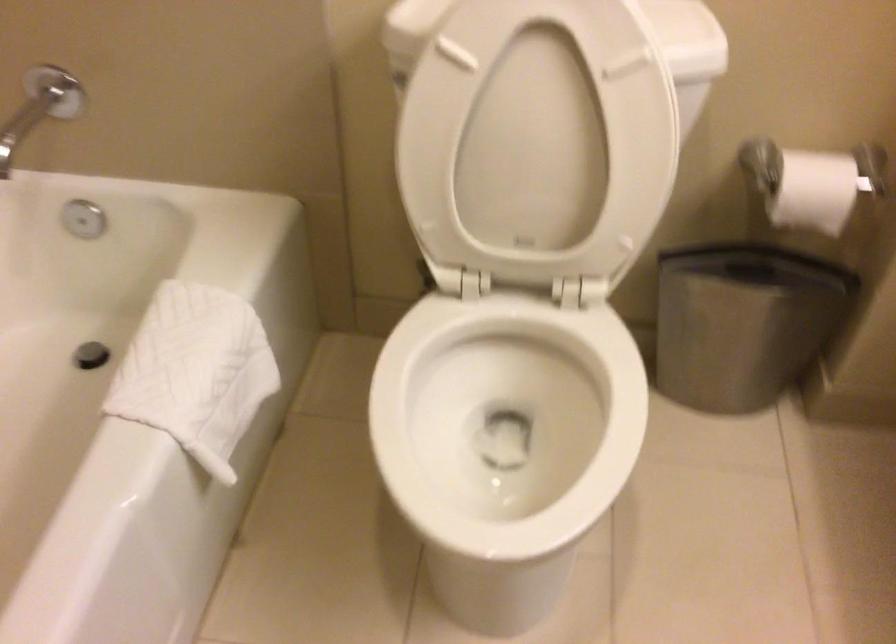
In order to click on silver faucet knob in this screenshot , I will do `click(83, 219)`.